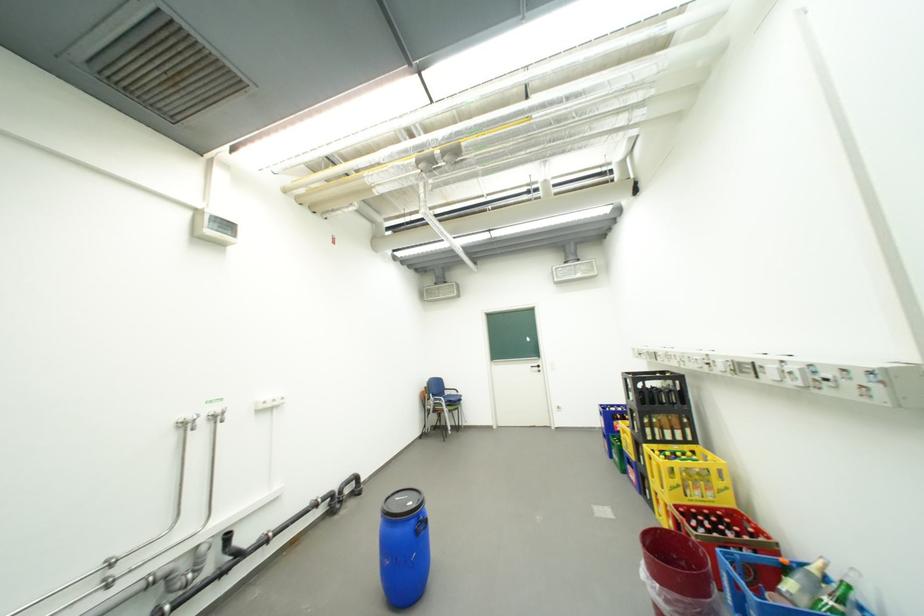
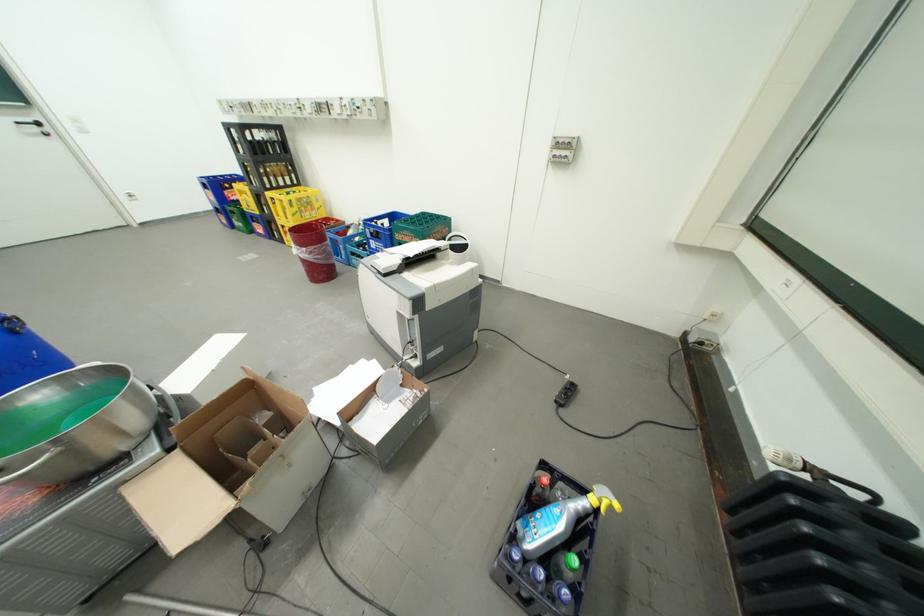
Where in the second image is the point corresponding to the point at 691,490 from the first image?

(310, 215)